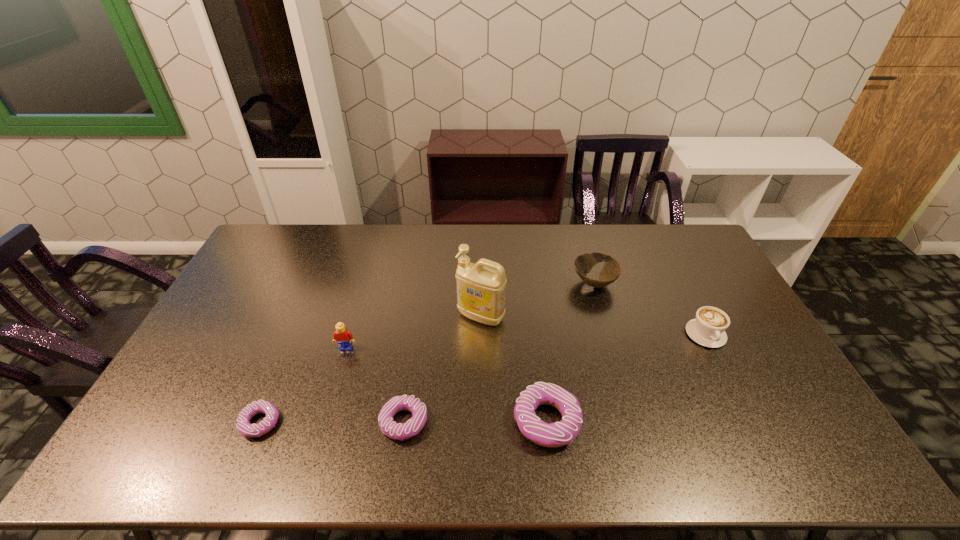
Locate an element on the screen. This screenshot has height=540, width=960. doughnut that is the third closest to the fourth object from right to left is located at coordinates (243, 424).

Identify the location of free space that satisfies the following two spatial constraints: 1. on the back side of the sixth tallest object; 2. on the left side of the bowl. The height and width of the screenshot is (540, 960). (423, 283).

This screenshot has width=960, height=540. What are the coordinates of `vacant space that satisfies the following two spatial constraints: 1. on the back side of the fourth object from right to left; 2. on the right side of the second tallest doughnut` in the screenshot? It's located at (419, 316).

Locate an element on the screen. vacant space that satisfies the following two spatial constraints: 1. on the back side of the leftmost doughnut; 2. on the right side of the detergent is located at coordinates (304, 316).

Where is `vacant space that satisfies the following two spatial constraints: 1. on the back side of the shortest object; 2. on the right side of the tallest doughnut`? vacant space that satisfies the following two spatial constraints: 1. on the back side of the shortest object; 2. on the right side of the tallest doughnut is located at coordinates (261, 421).